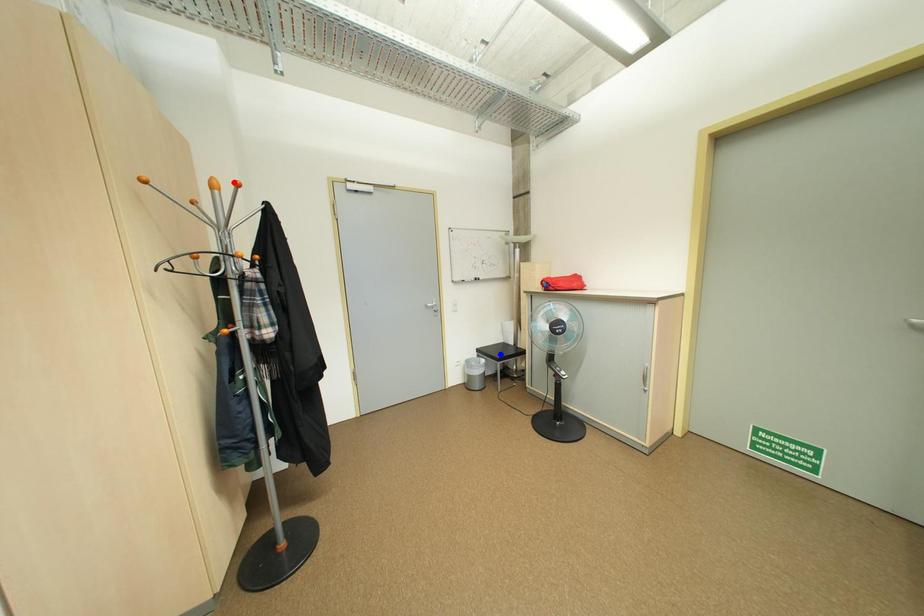
Question: In the image, two points are highlighted. Which point is nearer to the camera? Reply with the corresponding letter.

Choices:
 (A) blue point
 (B) red point

Answer: (B)